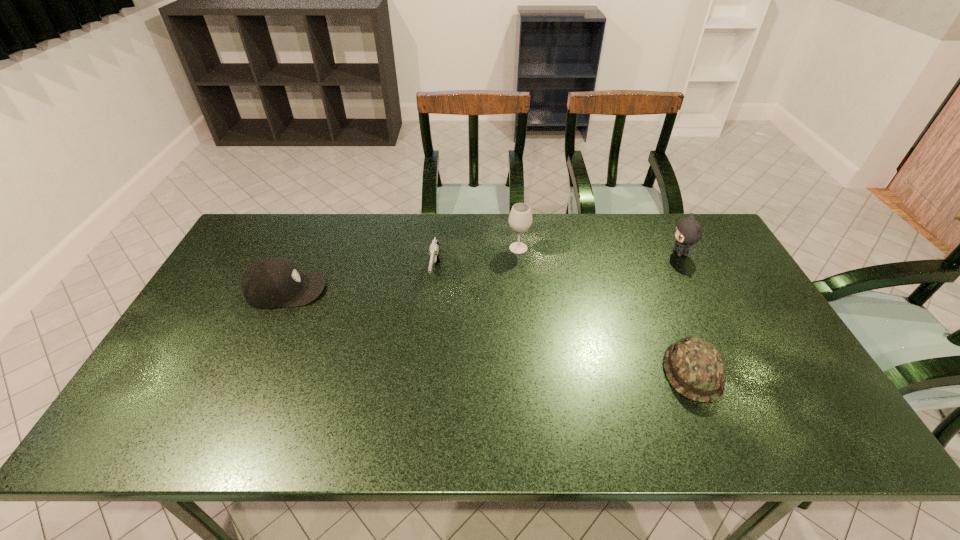
Where is `empty space that is in between the taller headwear and the tallest object`? The width and height of the screenshot is (960, 540). empty space that is in between the taller headwear and the tallest object is located at coordinates (402, 269).

At what (x,y) coordinates should I click in order to perform the action: click on free spot between the taller headwear and the kitten. Please return your answer as a coordinate pair (x, y). Looking at the image, I should click on (483, 271).

You are a GUI agent. You are given a task and a screenshot of the screen. Output one action in this format:
    pyautogui.click(x=<x>, y=<y>)
    Task: Click on the free space between the right headwear and the left headwear
    
    Given the screenshot: What is the action you would take?
    pyautogui.click(x=490, y=331)

The width and height of the screenshot is (960, 540). What are the coordinates of `free space between the fourth object from right to left and the rightmost object` in the screenshot? It's located at 558,264.

Where is `unoccupied area between the left headwear and the rightmost object`? This screenshot has height=540, width=960. unoccupied area between the left headwear and the rightmost object is located at coordinates (483, 271).

Locate an element on the screen. vacant region between the second object from left to right and the tallest object is located at coordinates (477, 261).

At what (x,y) coordinates should I click in order to perform the action: click on free point between the nearer headwear and the fourth object from right to left. Please return your answer as a coordinate pair (x, y). The image size is (960, 540). Looking at the image, I should click on (564, 323).

Identify which object is the second nearest to the nearer headwear. Please provide its 2D coordinates. Your answer should be formatted as a tuple, i.e. [(x, y)], where the tuple contains the x and y coordinates of a point satisfying the conditions above.

[(520, 219)]

Choose which object is the third nearest neighbor to the third object from right to left. Please provide its 2D coordinates. Your answer should be formatted as a tuple, i.e. [(x, y)], where the tuple contains the x and y coordinates of a point satisfying the conditions above.

[(695, 368)]

You are a GUI agent. You are given a task and a screenshot of the screen. Output one action in this format:
    pyautogui.click(x=<x>, y=<y>)
    Task: Click on the vacant region that satisfies the following two spatial constraints: 1. on the front-facing side of the kitten; 2. on the front side of the shorter headwear
    The image size is (960, 540).
    Given the screenshot: What is the action you would take?
    pyautogui.click(x=742, y=372)